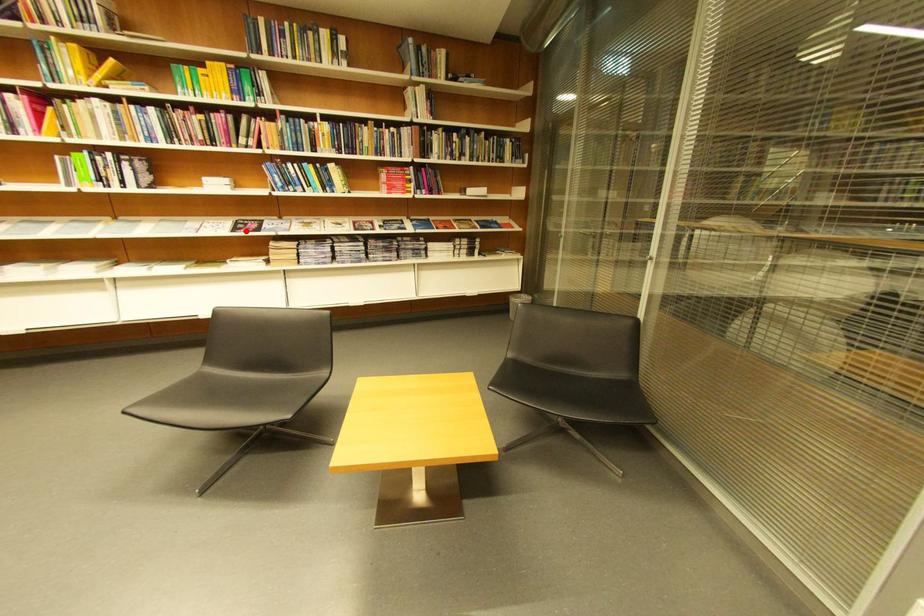
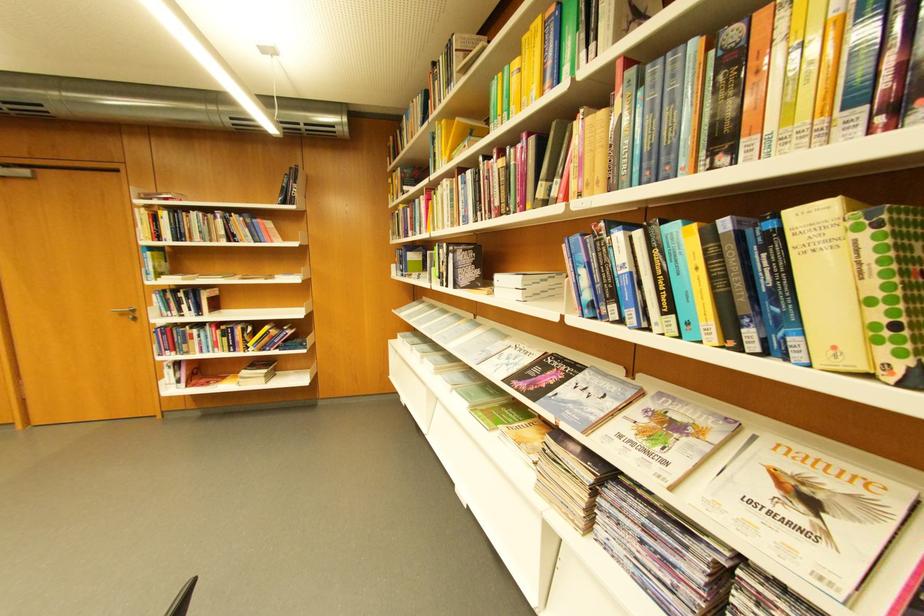
Question: A red point is marked in image1. In image2, is the corresponding 3D point closer to the camera or farther? Reply with the corresponding letter.

Choices:
 (A) The corresponding 3D point is closer.
 (B) The corresponding 3D point is farther.

Answer: (B)